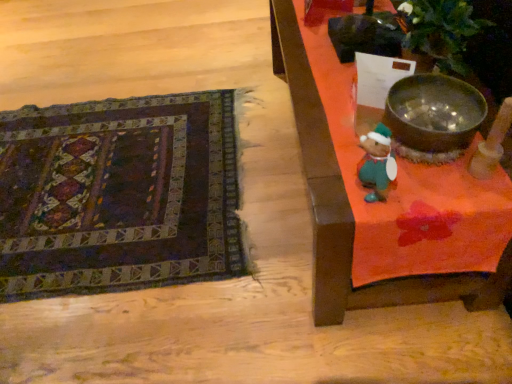
Question: Does wooden table at right have a smaller size compared to dark woven rug at lower left?

Choices:
 (A) no
 (B) yes

Answer: (A)

Question: From the image's perspective, is wooden table at right above dark woven rug at lower left?

Choices:
 (A) yes
 (B) no

Answer: (A)

Question: Is wooden table at right to the left of dark woven rug at lower left from the viewer's perspective?

Choices:
 (A) no
 (B) yes

Answer: (A)

Question: Is the depth of wooden table at right less than that of dark woven rug at lower left?

Choices:
 (A) yes
 (B) no

Answer: (A)

Question: Considering the relative sizes of wooden table at right and dark woven rug at lower left in the image provided, is wooden table at right bigger than dark woven rug at lower left?

Choices:
 (A) no
 (B) yes

Answer: (B)

Question: Is wooden table at right wider or thinner than shiny metallic bowl at upper right?

Choices:
 (A) thin
 (B) wide

Answer: (B)

Question: From the image's perspective, is wooden table at right positioned above or below shiny metallic bowl at upper right?

Choices:
 (A) above
 (B) below

Answer: (A)

Question: Choose the correct answer: Is wooden table at right inside shiny metallic bowl at upper right or outside it?

Choices:
 (A) outside
 (B) inside

Answer: (A)

Question: Would you say wooden table at right is to the left or to the right of shiny metallic bowl at upper right in the picture?

Choices:
 (A) left
 (B) right

Answer: (A)

Question: Is shiny metallic bowl at upper right inside the boundaries of dark woven rug at lower left, or outside?

Choices:
 (A) outside
 (B) inside

Answer: (A)

Question: In the image, is shiny metallic bowl at upper right on the left side or the right side of dark woven rug at lower left?

Choices:
 (A) left
 (B) right

Answer: (B)

Question: From a real-world perspective, relative to dark woven rug at lower left, is shiny metallic bowl at upper right vertically above or below?

Choices:
 (A) above
 (B) below

Answer: (A)

Question: Looking at the image, does shiny metallic bowl at upper right seem bigger or smaller compared to dark woven rug at lower left?

Choices:
 (A) big
 (B) small

Answer: (B)

Question: In terms of height, does dark woven rug at lower left look taller or shorter compared to wooden table at right?

Choices:
 (A) short
 (B) tall

Answer: (A)

Question: Is dark woven rug at lower left spatially inside wooden table at right, or outside of it?

Choices:
 (A) inside
 (B) outside

Answer: (B)